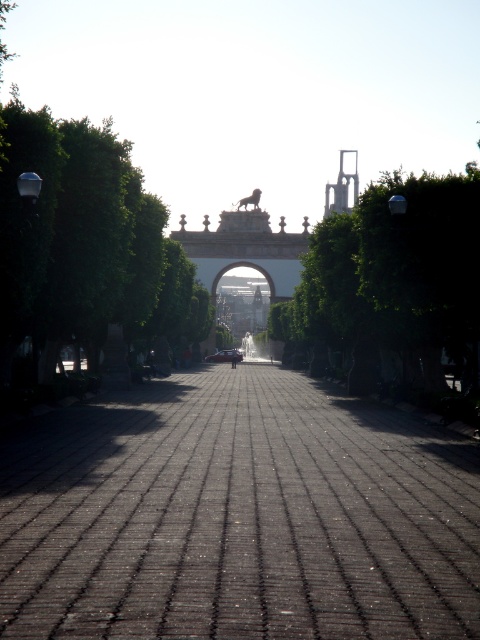
Question: Which point is farther to the camera?

Choices:
 (A) green leafy tree at center
 (B) dark brick pathway at center
 (C) shiny red car at center

Answer: (C)

Question: Estimate the real-world distances between objects in this image. Which object is closer to the green leafy tree at center?

Choices:
 (A) dark brick pathway at center
 (B) shiny red car at center

Answer: (A)

Question: Is green leafy tree at center wider than shiny red car at center?

Choices:
 (A) yes
 (B) no

Answer: (A)

Question: Does dark brick pathway at center lie behind shiny red car at center?

Choices:
 (A) no
 (B) yes

Answer: (A)

Question: Which of these objects is positioned farthest from the shiny red car at center?

Choices:
 (A) green leafy tree at center
 (B) dark brick pathway at center

Answer: (B)

Question: Is dark brick pathway at center positioned behind shiny red car at center?

Choices:
 (A) no
 (B) yes

Answer: (A)